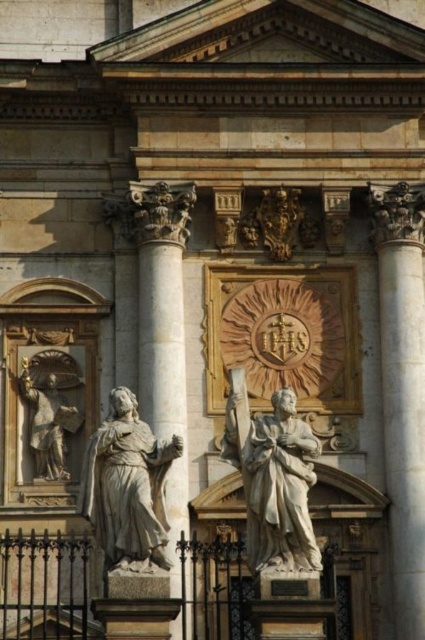
Question: Estimate the real-world distances between objects in this image. Which object is closer to the white marble statue at center?

Choices:
 (A) white marble column at right
 (B) white marble statue at center-left
 (C) white marble column at center

Answer: (B)

Question: Considering the relative positions of white marble statue at center and white marble column at center in the image provided, where is white marble statue at center located with respect to white marble column at center?

Choices:
 (A) above
 (B) below

Answer: (B)

Question: Which point appears closest to the camera in this image?

Choices:
 (A) (149, 280)
 (B) (142, 545)

Answer: (B)

Question: Which point appears closest to the camera in this image?

Choices:
 (A) (59, 380)
 (B) (99, 428)

Answer: (B)

Question: Does white marble column at right lie behind white marble statue at center?

Choices:
 (A) no
 (B) yes

Answer: (B)

Question: Is white marble statue at center smaller than white marble statue at center-left?

Choices:
 (A) yes
 (B) no

Answer: (B)